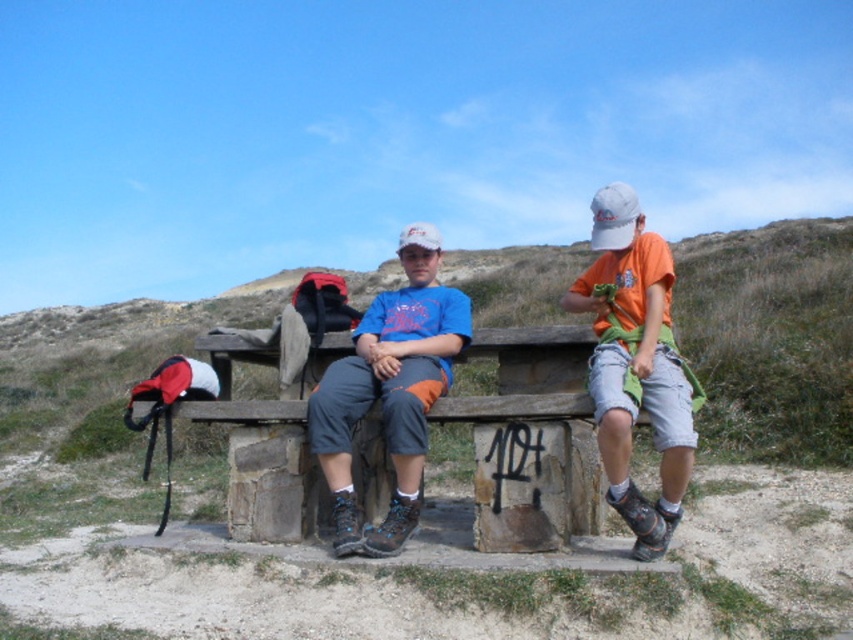
How far apart are wooden bench at center and matte blue t-shirt at center?

wooden bench at center is 36.25 inches away from matte blue t-shirt at center.

Is wooden bench at center behind matte blue t-shirt at center?

No, it is in front of matte blue t-shirt at center.

Does point (585, 342) come closer to viewer compared to point (412, 236)?

Yes, it is.

Locate an element on the screen. This screenshot has height=640, width=853. wooden bench at center is located at coordinates [x=537, y=420].

Does orange cotton shirt at right appear over matte blue t-shirt at center?

Correct, orange cotton shirt at right is located above matte blue t-shirt at center.

Describe the element at coordinates (635, 364) in the screenshot. I see `orange cotton shirt at right` at that location.

Does point (618, 220) come in front of point (321, 392)?

That is True.

Where is `orange cotton shirt at right`? The image size is (853, 640). orange cotton shirt at right is located at coordinates (635, 364).

Which is above, wooden bench at center or orange cotton shirt at right?

orange cotton shirt at right is higher up.

Who is taller, wooden bench at center or orange cotton shirt at right?

With more height is orange cotton shirt at right.

What do you see at coordinates (537, 420) in the screenshot? This screenshot has height=640, width=853. I see `wooden bench at center` at bounding box center [537, 420].

Find the location of a particular element. wooden bench at center is located at coordinates (537, 420).